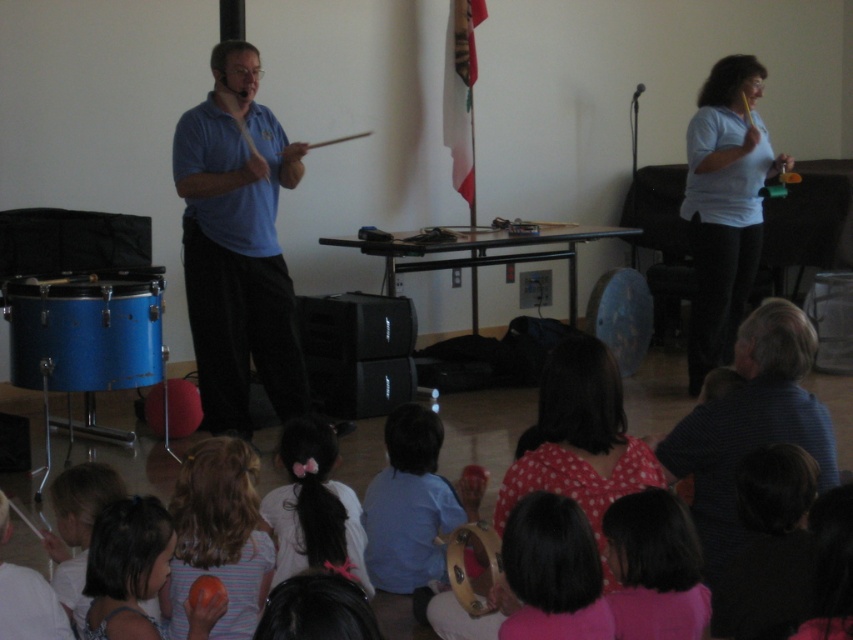
You are a photographer setting up for a group photo in the music class. You need to decide where to place a narrow spotlight. The pink fabric at lower right and the blonde hair at lower left are both in your frame. Which object is more suitable for the spotlight if you want to highlight something thinner?

The pink fabric at lower right is thinner than the blonde hair at lower left, so it is more suitable for the spotlight if you want to highlight something thinner.